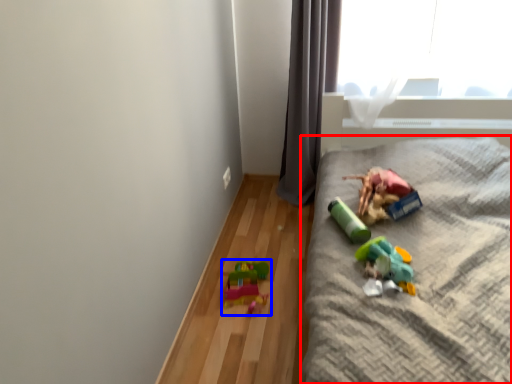
Question: Which object is further to the camera taking this photo, furniture (highlighted by a red box) or toy (highlighted by a blue box)?

Choices:
 (A) furniture
 (B) toy

Answer: (B)